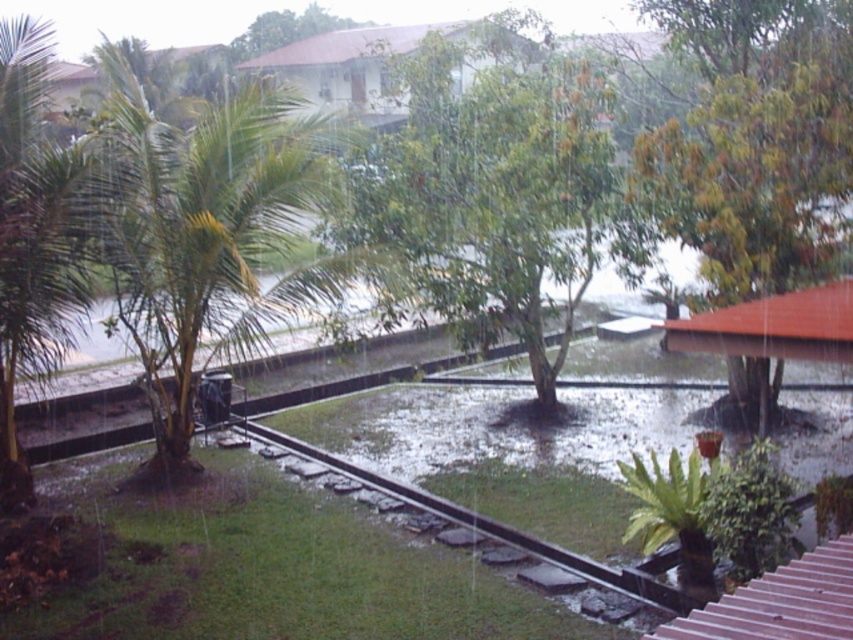
Question: Which of these objects is positioned closest to the green leafy tree at center?

Choices:
 (A) green leafy palm tree at left
 (B) black metal train track at center

Answer: (A)

Question: Among these points, which one is farthest from the camera?

Choices:
 (A) (170, 147)
 (B) (491, 525)

Answer: (A)

Question: Is green leafy palm tree at left to the right of black metal train track at center from the viewer's perspective?

Choices:
 (A) no
 (B) yes

Answer: (A)

Question: Is green leafy tree at center further to camera compared to green leafy palm tree at left?

Choices:
 (A) no
 (B) yes

Answer: (B)

Question: Does green leafy tree at center have a greater width compared to green leafy palm tree at left?

Choices:
 (A) no
 (B) yes

Answer: (A)

Question: Which object is positioned closest to the green leafy tree at center?

Choices:
 (A) green leafy palm tree at left
 (B) black metal train track at center

Answer: (A)